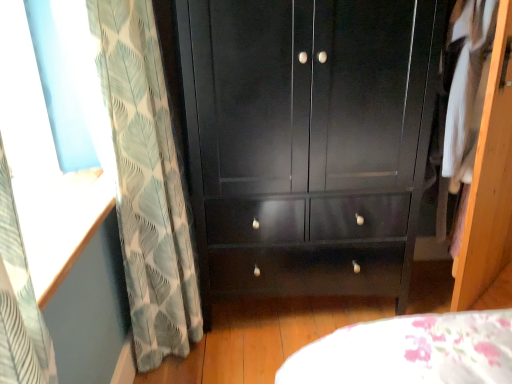
Question: Is white fabric at right positioned behind green leaf-patterned curtain at left?

Choices:
 (A) yes
 (B) no

Answer: (A)

Question: Is white fabric at right shorter than green leaf-patterned curtain at left?

Choices:
 (A) no
 (B) yes

Answer: (B)

Question: Could you tell me if white fabric at right is facing green leaf-patterned curtain at left?

Choices:
 (A) yes
 (B) no

Answer: (B)

Question: From the image's perspective, would you say white fabric at right is shown under green leaf-patterned curtain at left?

Choices:
 (A) no
 (B) yes

Answer: (A)

Question: Considering the relative sizes of white fabric at right and green leaf-patterned curtain at left in the image provided, is white fabric at right thinner than green leaf-patterned curtain at left?

Choices:
 (A) yes
 (B) no

Answer: (B)

Question: Is white fabric at right in front of or behind green leaf-patterned curtain at left in the image?

Choices:
 (A) front
 (B) behind

Answer: (B)

Question: Looking at their shapes, would you say white fabric at right is wider or thinner than green leaf-patterned curtain at left?

Choices:
 (A) thin
 (B) wide

Answer: (B)

Question: Visually, is white fabric at right positioned to the left or to the right of green leaf-patterned curtain at left?

Choices:
 (A) left
 (B) right

Answer: (B)

Question: Is point pyautogui.click(x=455, y=3) closer or farther from the camera than point pyautogui.click(x=189, y=289)?

Choices:
 (A) farther
 (B) closer

Answer: (B)

Question: Considering their positions, is glossy black cupboard at center located in front of or behind green leaf-patterned curtain at left?

Choices:
 (A) front
 (B) behind

Answer: (B)

Question: Considering the relative positions of glossy black cupboard at center and green leaf-patterned curtain at left in the image provided, is glossy black cupboard at center to the left or to the right of green leaf-patterned curtain at left?

Choices:
 (A) right
 (B) left

Answer: (A)

Question: From a real-world perspective, is glossy black cupboard at center positioned above or below green leaf-patterned curtain at left?

Choices:
 (A) above
 (B) below

Answer: (B)

Question: Is glossy black cupboard at center inside or outside of green leaf-patterned curtain at left?

Choices:
 (A) outside
 (B) inside

Answer: (A)

Question: From a real-world perspective, is white fabric at right positioned above or below glossy black cupboard at center?

Choices:
 (A) above
 (B) below

Answer: (A)

Question: Considering the relative positions of white fabric at right and glossy black cupboard at center in the image provided, is white fabric at right to the left or to the right of glossy black cupboard at center?

Choices:
 (A) right
 (B) left

Answer: (A)